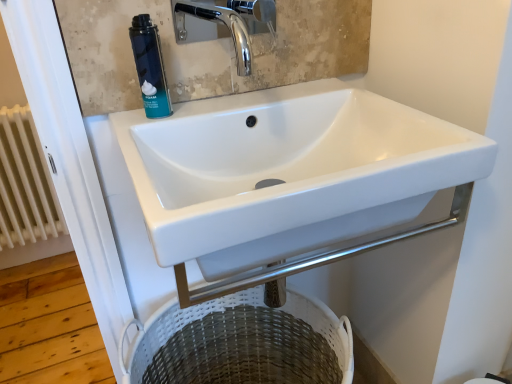
Where is `vacant space to the right of blue matte foam canister at upper left`? vacant space to the right of blue matte foam canister at upper left is located at coordinates (230, 109).